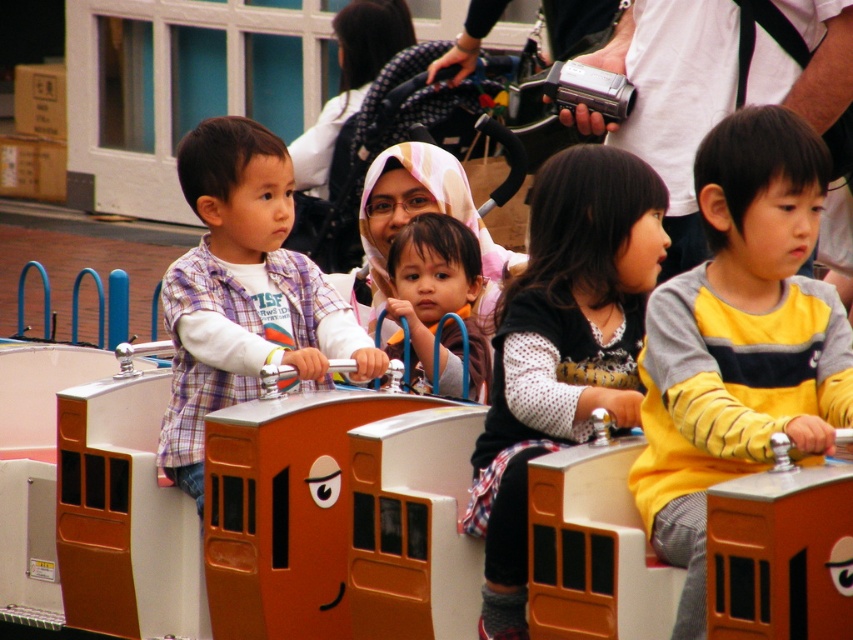
Which is behind, point (677, 483) or point (532, 400)?

The point (532, 400) is more distant.

At what (x,y) coordinates should I click in order to perform the action: click on yellow striped sweater at center. Please return your answer as a coordinate pair (x, y). The image size is (853, 640). Looking at the image, I should click on (740, 339).

Is point (828, 289) closer to viewer compared to point (480, 499)?

No, it is not.

Image resolution: width=853 pixels, height=640 pixels. Find the location of `yellow striped sweater at center`. yellow striped sweater at center is located at coordinates (740, 339).

Is plaid fabric shirt at left positioned in front of matte plastic toy at center?

Yes, it is.

Does point (225, 353) come in front of point (416, 340)?

Yes, it is in front of point (416, 340).

Image resolution: width=853 pixels, height=640 pixels. Identify the location of plaid fabric shirt at left. (242, 291).

Looking at this image, who is positioned more to the right, yellow striped sweater at center or plaid fabric shirt at left?

Positioned to the right is yellow striped sweater at center.

From the picture: Who is lower down, yellow striped sweater at center or plaid fabric shirt at left?

yellow striped sweater at center

Who is more forward, [686,579] or [228,372]?

Point [686,579] is more forward.

At what (x,y) coordinates should I click in order to perform the action: click on yellow striped sweater at center. Please return your answer as a coordinate pair (x, y). Looking at the image, I should click on (740, 339).